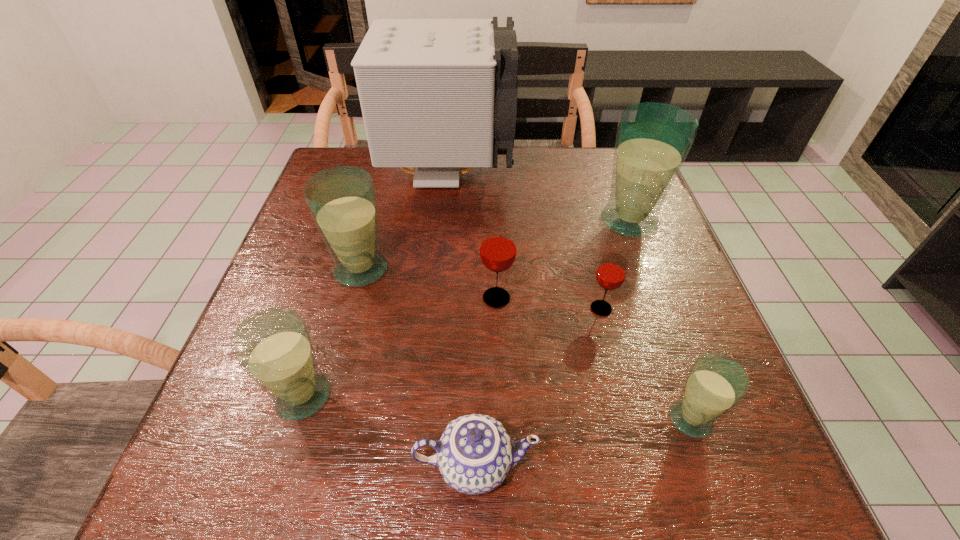
Image resolution: width=960 pixels, height=540 pixels. In order to click on vacant area situated 0.230m on the back of the smallest blue glass in this screenshot , I will do `click(648, 298)`.

Locate an element on the screen. This screenshot has height=540, width=960. vacant region located from the spout of the shortest object is located at coordinates (567, 465).

Where is `object at the far edge`? This screenshot has width=960, height=540. object at the far edge is located at coordinates (437, 96).

Locate an element on the screen. object located in the near edge section of the desktop is located at coordinates (474, 454).

This screenshot has width=960, height=540. Identify the location of free space at the far edge. (467, 184).

Where is `free region at the near edge of the desktop`? Image resolution: width=960 pixels, height=540 pixels. free region at the near edge of the desktop is located at coordinates click(x=653, y=467).

Where is `vacant space at the left edge of the desktop`? Image resolution: width=960 pixels, height=540 pixels. vacant space at the left edge of the desktop is located at coordinates (304, 306).

Where is `vacant space at the right edge of the desktop`? This screenshot has height=540, width=960. vacant space at the right edge of the desktop is located at coordinates (656, 320).

Identify the location of vacant space at the near left corner of the desktop. (241, 498).

You are a GUI agent. You are given a task and a screenshot of the screen. Output one action in this format:
    pyautogui.click(x=<x>, y=<y>)
    Task: Click on the free region at the near right corner of the desktop
    The image size is (960, 540).
    Given the screenshot: What is the action you would take?
    pyautogui.click(x=743, y=461)